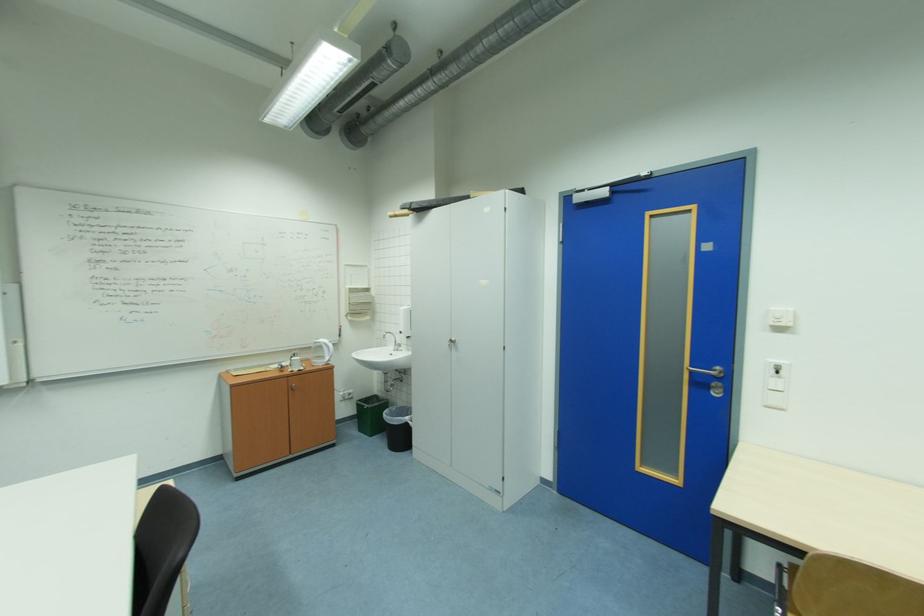
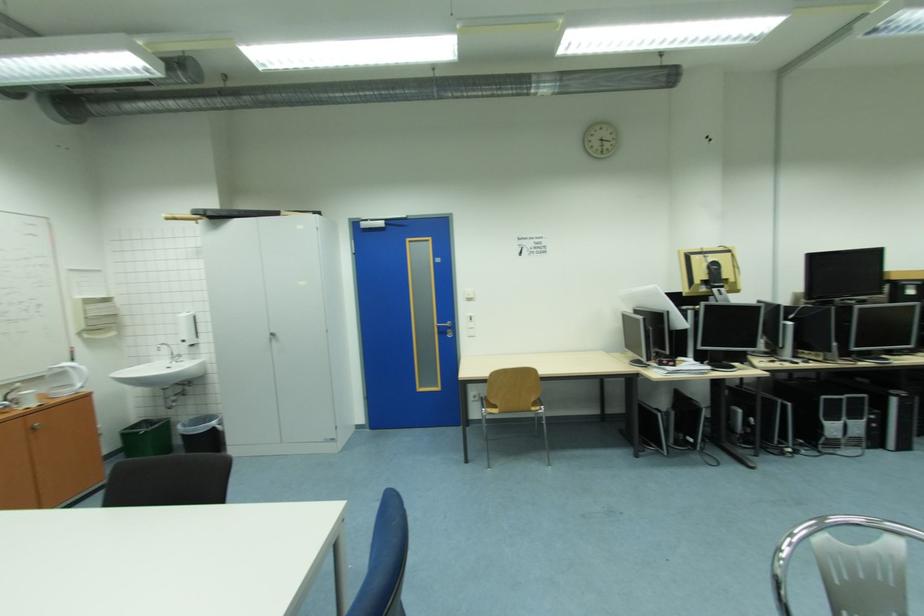
Where in the second image is the point corresponding to point (787, 331) from the first image?

(477, 301)